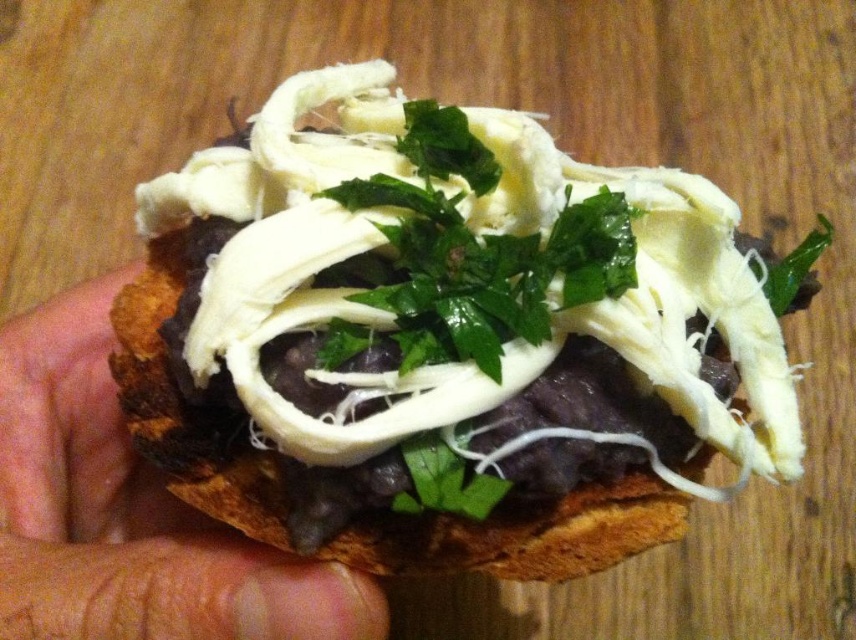
You are a food critic examining a dish. You notice the white creamy cheese at center and brown skin at center. Which ingredient is positioned higher on the dish?

The white creamy cheese at center is located above the brown skin at center, so it is positioned higher on the dish.

You are a food critic analyzing the spatial arrangement of ingredients in the sandwich. Where is the white creamy cheese at center positioned relative to the center of the image?

The white creamy cheese at center is positioned exactly at the center of the image, as its coordinates are very close to the center point.